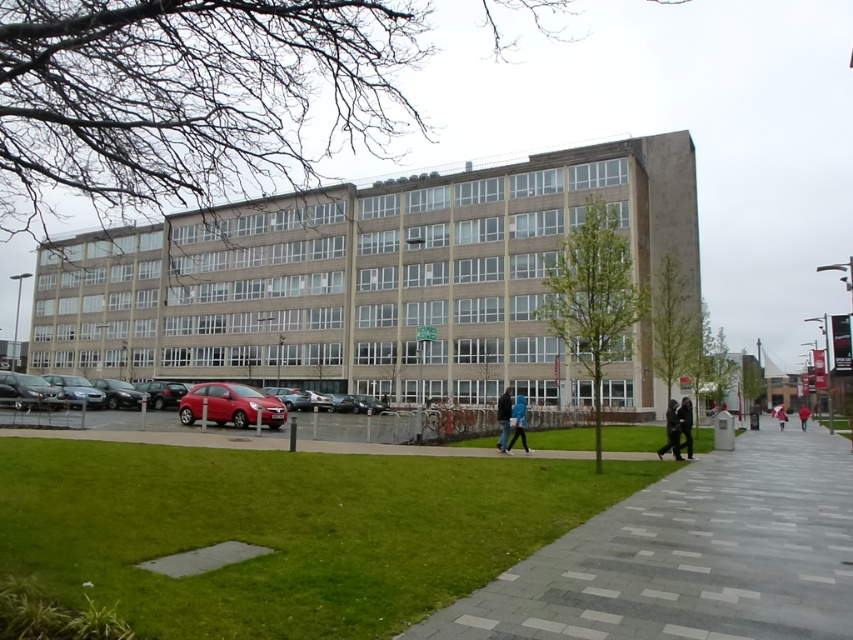
Does matte silver car at lower left appear over dark gray fabric jacket at lower right?

Indeed, matte silver car at lower left is positioned over dark gray fabric jacket at lower right.

From the picture: Can you confirm if matte silver car at lower left is taller than dark gray fabric jacket at lower right?

No, matte silver car at lower left is not taller than dark gray fabric jacket at lower right.

This screenshot has height=640, width=853. Describe the element at coordinates (76, 390) in the screenshot. I see `matte silver car at lower left` at that location.

Identify the location of matte silver car at lower left. (76, 390).

Does shiny silver sedan at lower left have a lesser width compared to red umbrella at center?

Yes, shiny silver sedan at lower left is thinner than red umbrella at center.

Which is more to the left, shiny silver sedan at lower left or red umbrella at center?

From the viewer's perspective, shiny silver sedan at lower left appears more on the left side.

Does point (39, 378) come behind point (776, 416)?

No, it is in front of (776, 416).

Where is `shiny silver sedan at lower left`? shiny silver sedan at lower left is located at coordinates (27, 392).

Which is more to the left, shiny black sedan at lower left or red umbrella at center?

shiny black sedan at lower left is more to the left.

Does shiny black sedan at lower left have a larger size compared to red umbrella at center?

Incorrect, shiny black sedan at lower left is not larger than red umbrella at center.

Find the location of a particular element. The image size is (853, 640). shiny black sedan at lower left is located at coordinates (117, 394).